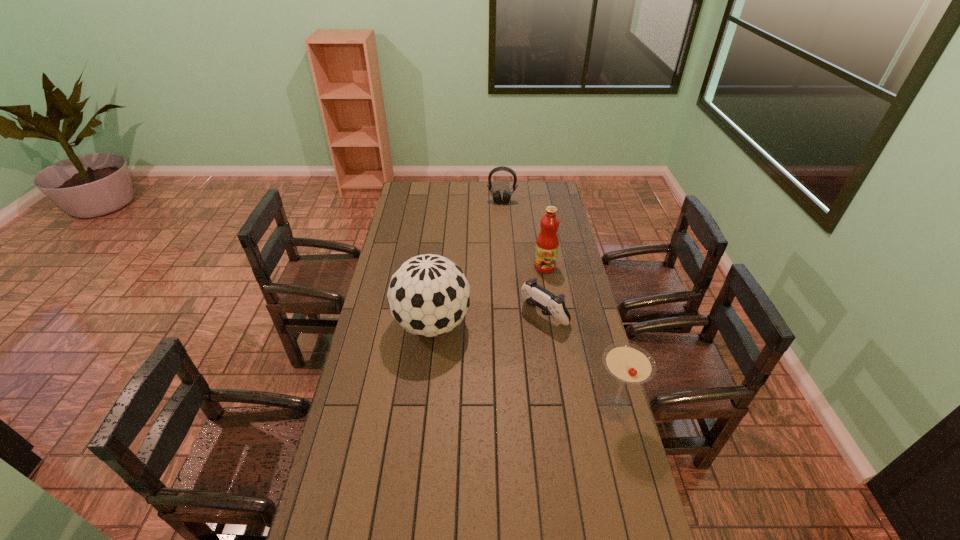
The height and width of the screenshot is (540, 960). I want to click on vacant space on the desktop that is between the soccer ball and the nearest object and is positioned on the front-facing side of the fourth tallest object, so click(x=492, y=352).

Locate an element on the screen. free space on the desktop that is between the soccer ball and the rightmost object and is positioned on the front label of the fourth nearest object is located at coordinates (516, 363).

Where is `vacant space on the desktop that is between the leftmost object and the third tallest object and is positioned on the front-facing side of the control`? Image resolution: width=960 pixels, height=540 pixels. vacant space on the desktop that is between the leftmost object and the third tallest object and is positioned on the front-facing side of the control is located at coordinates (496, 354).